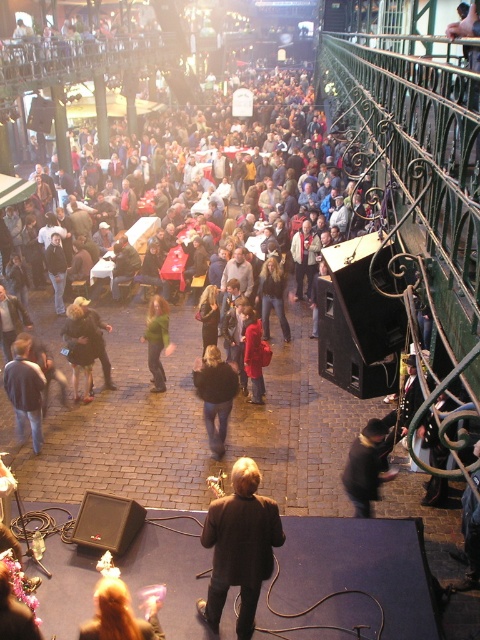
Question: Which of the following is the farthest from the observer?

Choices:
 (A) dark brown leather jacket at center
 (B) black fuzzy coat at center
 (C) black matte coat at center
 (D) blonde hair at lower left

Answer: (A)

Question: Among these points, which one is farthest from the camera?

Choices:
 (A) (73, 320)
 (B) (149, 618)

Answer: (A)

Question: Does black leather jacket at center have a smaller size compared to dark brown leather jacket at center?

Choices:
 (A) yes
 (B) no

Answer: (A)

Question: Does black matte coat at center appear over red fabric coat at center?

Choices:
 (A) no
 (B) yes

Answer: (A)

Question: Is black matte coat at center thinner than dark brown leather jacket at center?

Choices:
 (A) yes
 (B) no

Answer: (B)

Question: Among these objects, which one is nearest to the camera?

Choices:
 (A) black fuzzy coat at center
 (B) denim jacket at lower left

Answer: (A)